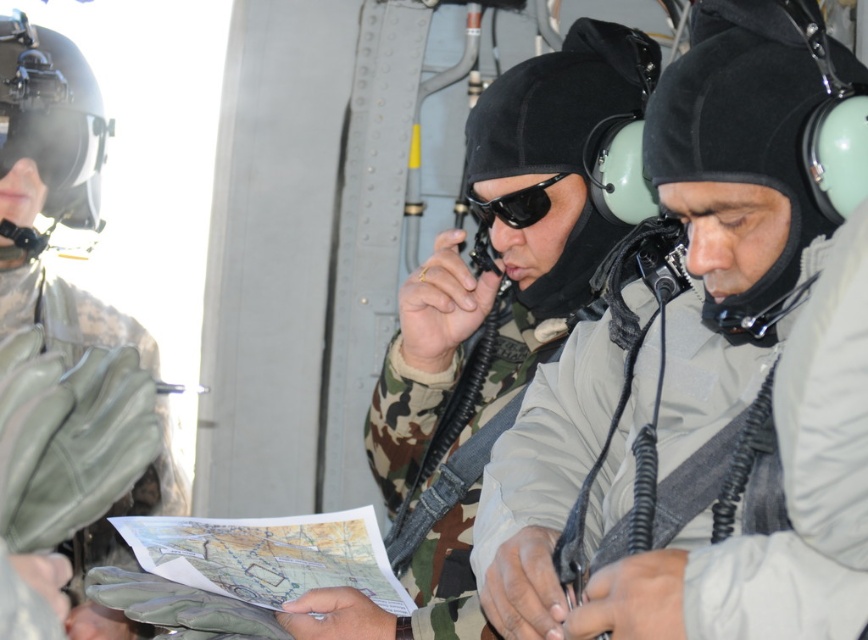
Does point (445, 600) come farther from viewer compared to point (511, 205)?

No, (445, 600) is closer to viewer.

Is camo fabric uniform at center further to the viewer compared to black matte sunglasses at center?

No, it is in front of black matte sunglasses at center.

Where is `camo fabric uniform at center`? The height and width of the screenshot is (640, 868). camo fabric uniform at center is located at coordinates (x=485, y=321).